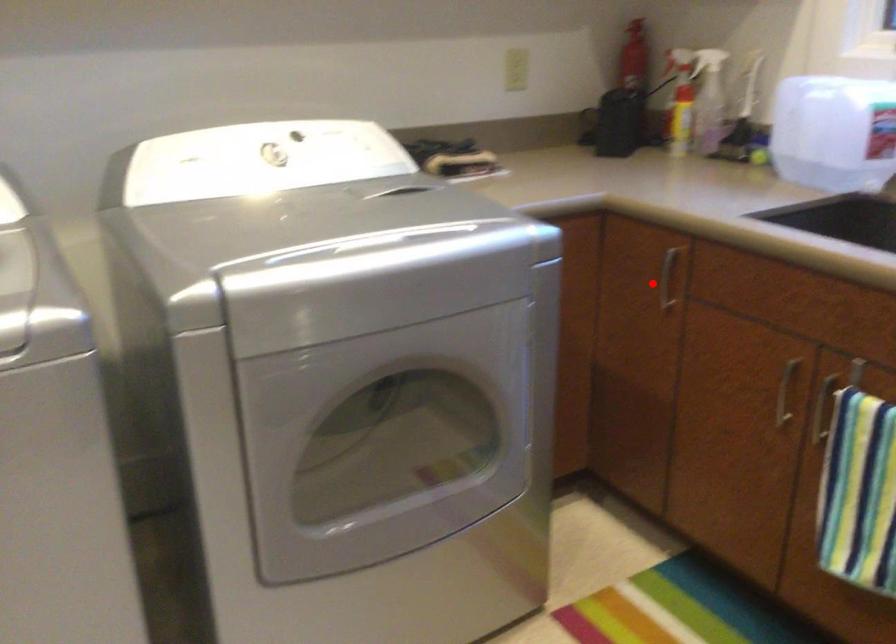
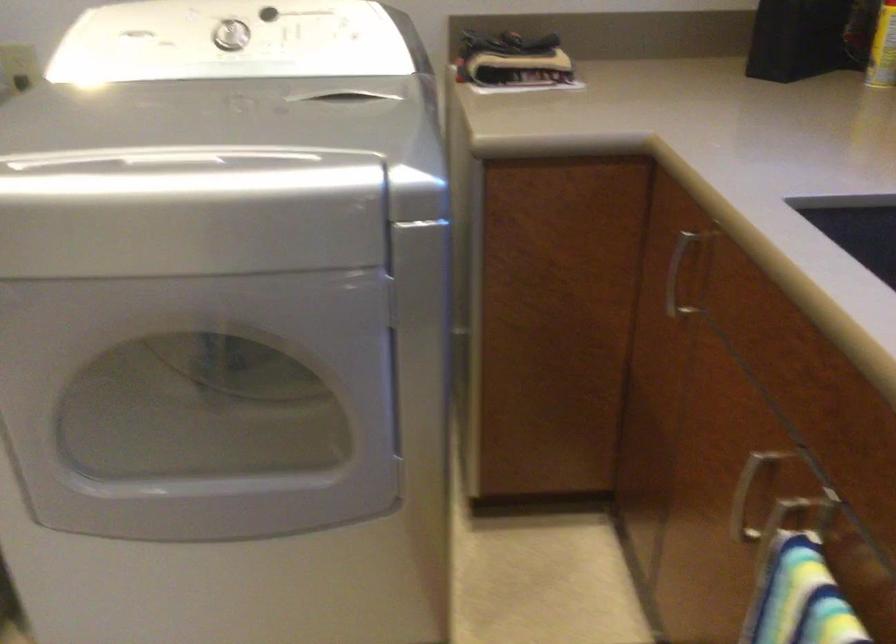
Question: I am providing you with two images of the same scene from different viewpoints. In image1, a red point is highlighted. Considering the same 3D point in image2, which of the following is correct?

Choices:
 (A) It is closer
 (B) It is farther

Answer: (A)